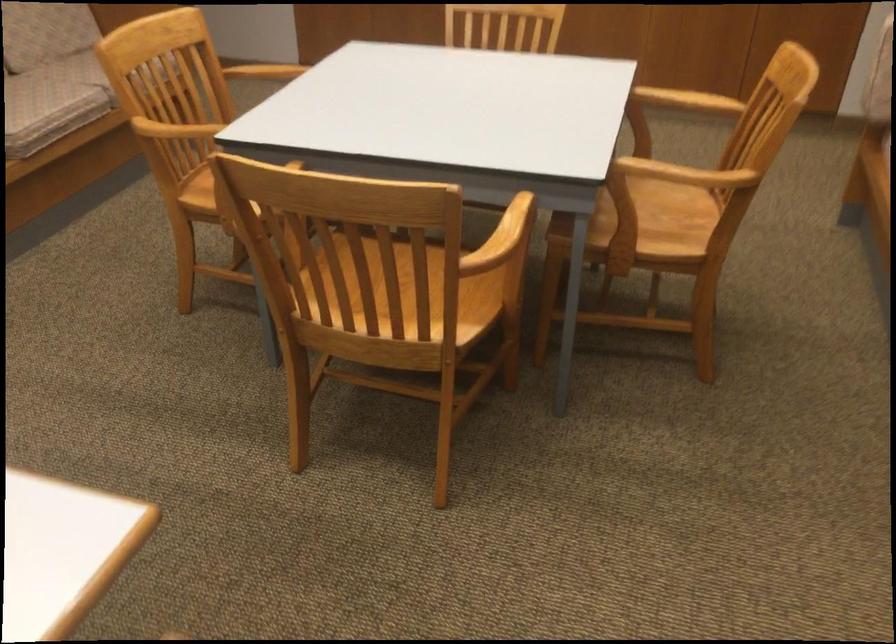
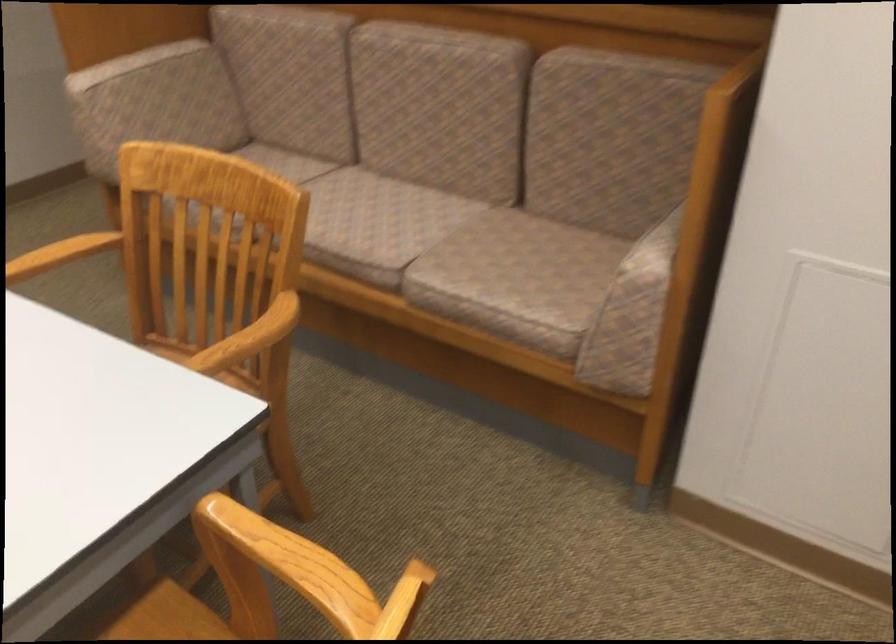
Locate, in the second image, the point that corresponds to point 705,95 in the first image.

(62, 252)